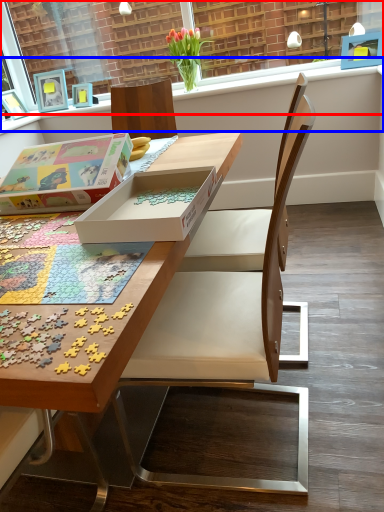
Question: Among these objects, which one is farthest to the camera, window frame (highlighted by a red box) or window sill (highlighted by a blue box)?

Choices:
 (A) window frame
 (B) window sill

Answer: (B)